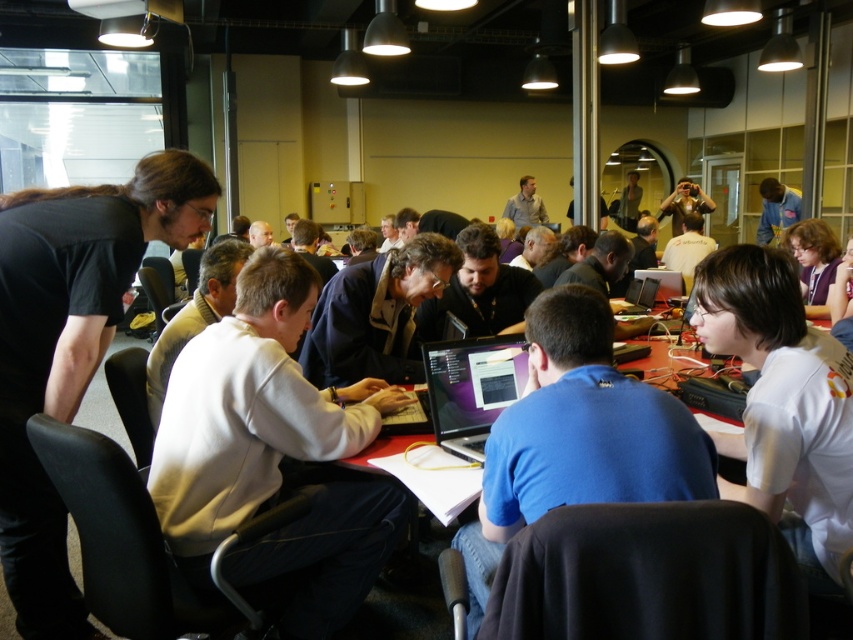
Question: Considering the relative positions of matte black shirt at upper right and silver metallic laptop at center in the image provided, where is matte black shirt at upper right located with respect to silver metallic laptop at center?

Choices:
 (A) left
 (B) right

Answer: (B)

Question: Estimate the real-world distances between objects in this image. Which object is farther from the white fleece jacket at center?

Choices:
 (A) shiny black laptop at center
 (B) red matte table at center

Answer: (B)

Question: Is black matte shirt at left closer to camera compared to red matte table at center?

Choices:
 (A) no
 (B) yes

Answer: (B)

Question: Which point is closer to the camera taking this photo?

Choices:
 (A) (653, 291)
 (B) (390, 440)
 (C) (764, 380)
 (D) (445, 387)

Answer: (C)

Question: Estimate the real-world distances between objects in this image. Which object is farther from the light gray shirt at center?

Choices:
 (A) silver metallic laptop at center
 (B) red matte table at center
 (C) matte black shirt at upper right

Answer: (B)

Question: Can you confirm if matte black shirt at upper right is positioned to the left of silver metallic laptop at center?

Choices:
 (A) no
 (B) yes

Answer: (A)